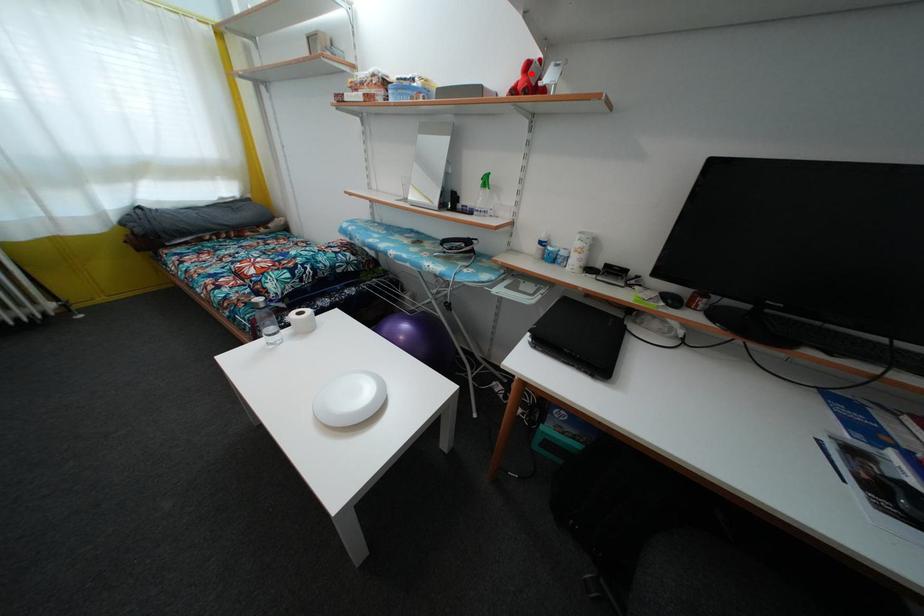
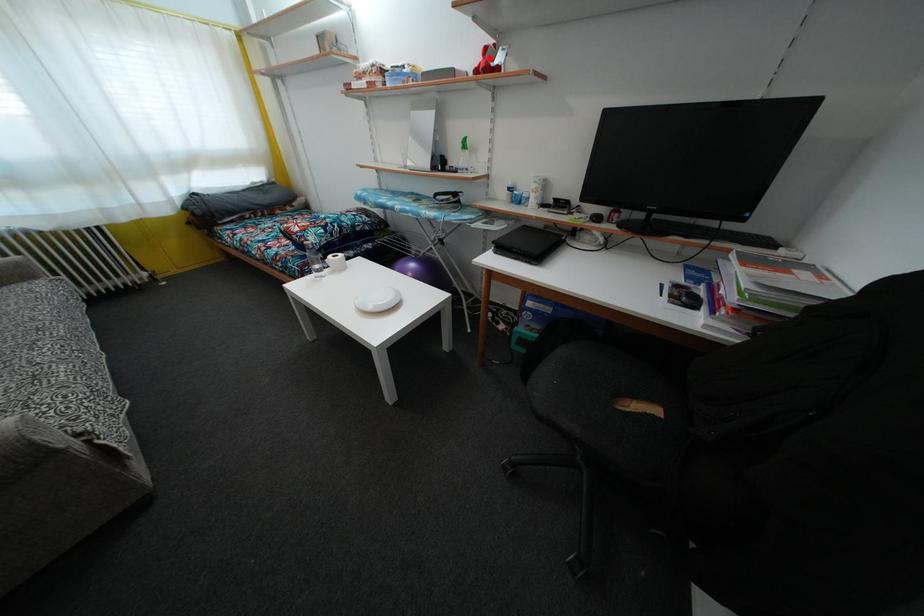
I am providing you with two images of the same scene from different viewpoints. A red point is marked on the first image and another point is marked on the second image. Are the points marked in image1 and image2 representing the same 3D position?

Yes